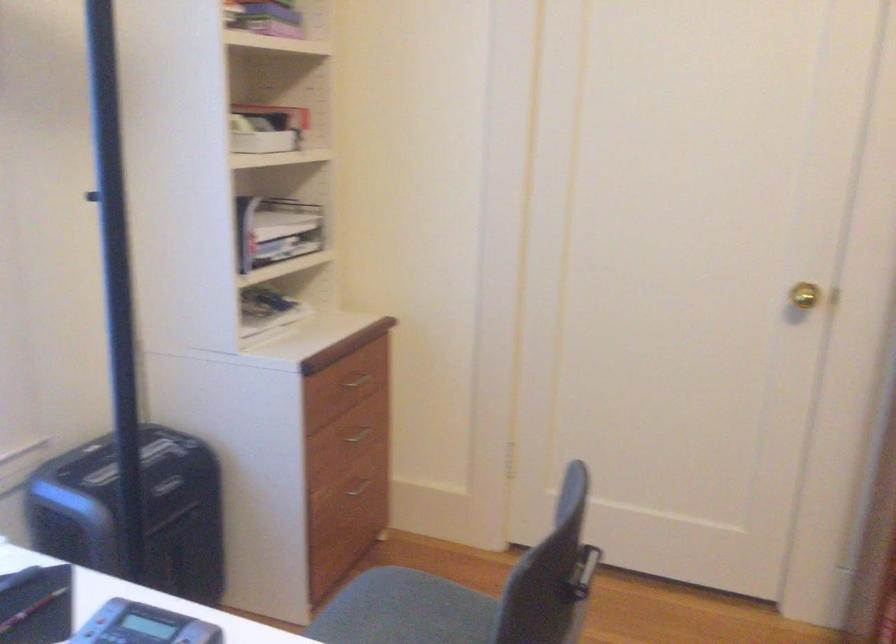
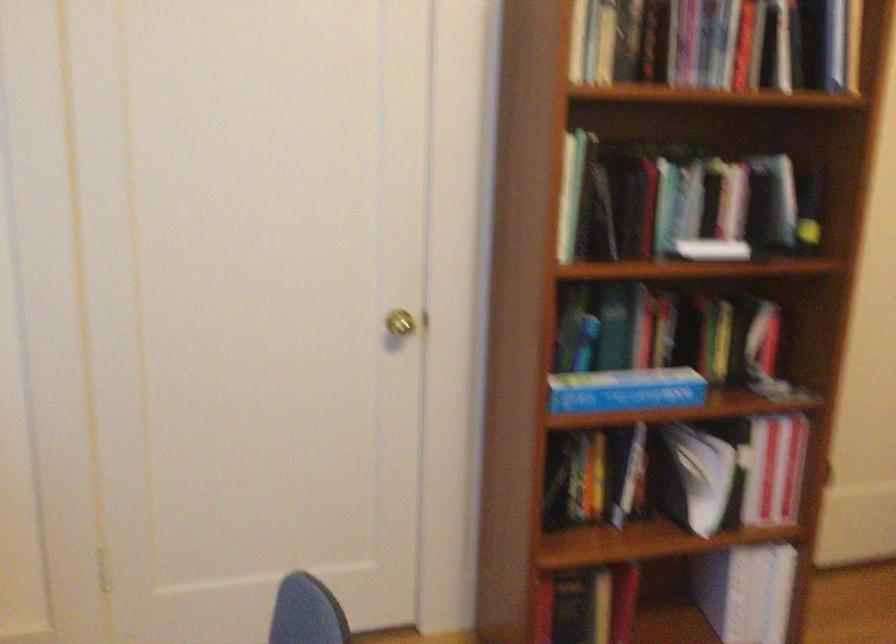
Question: The camera is either moving clockwise (left) or counter-clockwise (right) around the object. The first image is from the beginning of the video and the second image is from the end. Is the camera moving left or right when shooting the video?

Choices:
 (A) Left
 (B) Right

Answer: (A)